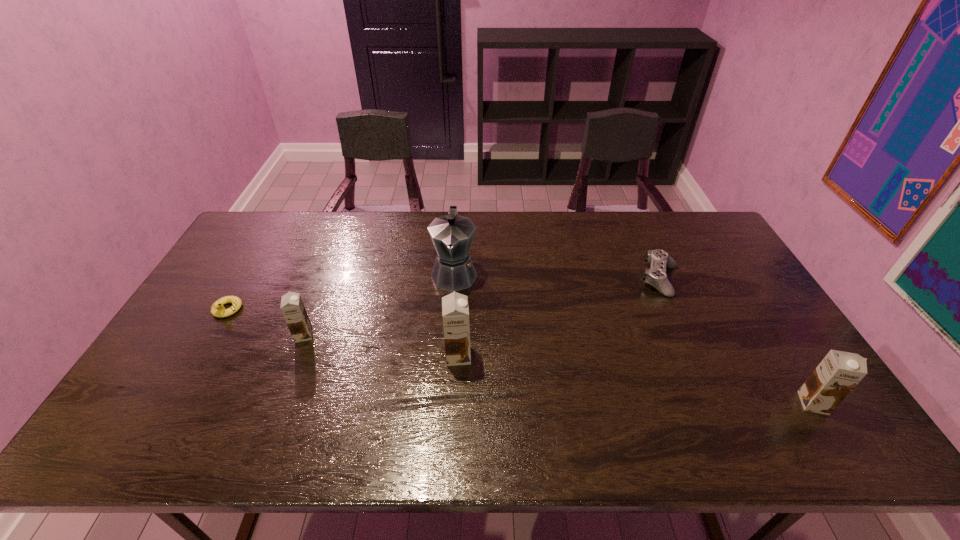
The width and height of the screenshot is (960, 540). I want to click on the leftmost chocolate milk, so click(x=292, y=307).

Identify the location of the farthest chocolate milk. The width and height of the screenshot is (960, 540). (292, 307).

Where is `the fifth farthest object`? This screenshot has width=960, height=540. the fifth farthest object is located at coordinates (455, 312).

The width and height of the screenshot is (960, 540). Identify the location of the second chocolate milk from left to right. (455, 312).

Image resolution: width=960 pixels, height=540 pixels. I want to click on the second tallest chocolate milk, so click(x=839, y=372).

I want to click on the rightmost object, so click(x=839, y=372).

Where is `coffeepot`? The image size is (960, 540). coffeepot is located at coordinates pos(452,235).

Find the location of a particular element. Image resolution: width=960 pixels, height=540 pixels. control is located at coordinates (656, 276).

Find the location of a particular element. the fourth nearest object is located at coordinates (217, 309).

Where is `duckling`? duckling is located at coordinates (217, 309).